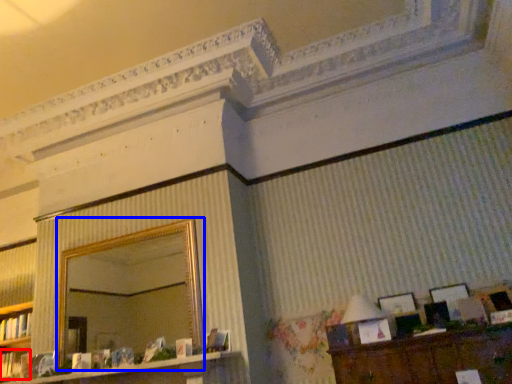
Question: Which point is closer to the camera, book (highlighted by a red box) or mirror (highlighted by a blue box)?

Choices:
 (A) book
 (B) mirror

Answer: (B)